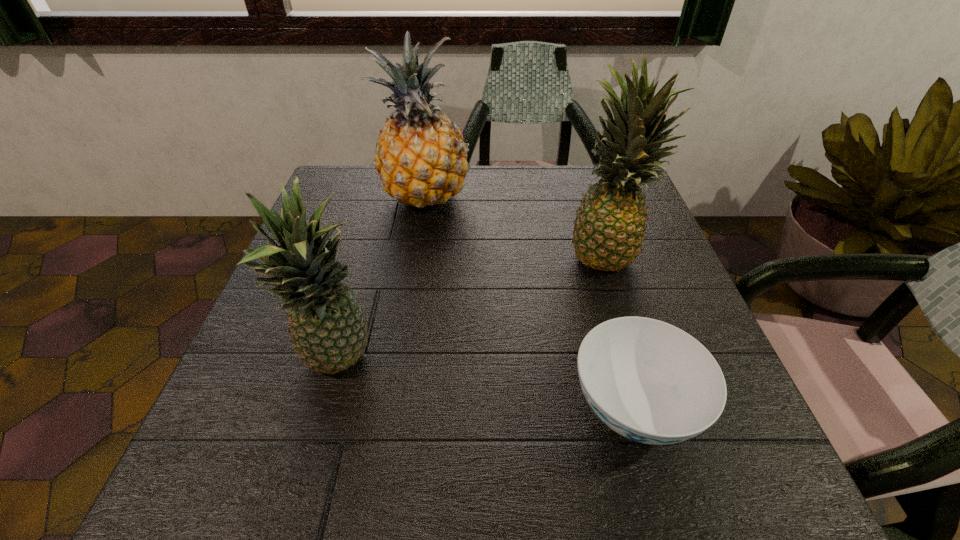
Where is `object located in the near edge section of the desktop`? The height and width of the screenshot is (540, 960). object located in the near edge section of the desktop is located at coordinates (649, 381).

Where is `pineapple that is at the right edge`? This screenshot has width=960, height=540. pineapple that is at the right edge is located at coordinates (609, 227).

The height and width of the screenshot is (540, 960). What are the coordinates of `chinaware present at the right edge` in the screenshot? It's located at (649, 381).

Where is `object that is at the far left corner`? Image resolution: width=960 pixels, height=540 pixels. object that is at the far left corner is located at coordinates (421, 159).

Where is `object present at the near right corner`? The image size is (960, 540). object present at the near right corner is located at coordinates (649, 381).

At what (x,y) coordinates should I click in order to perform the action: click on free space at the far edge. Please return your answer as a coordinate pair (x, y). The height and width of the screenshot is (540, 960). Looking at the image, I should click on (511, 200).

Where is `vacant space at the near edge of the desktop`? This screenshot has width=960, height=540. vacant space at the near edge of the desktop is located at coordinates (338, 460).

I want to click on vacant space at the left edge of the desktop, so click(208, 423).

At what (x,y) coordinates should I click in order to perform the action: click on vacant space at the right edge of the desktop. Please return your answer as a coordinate pair (x, y). This screenshot has width=960, height=540. Looking at the image, I should click on (637, 285).

Where is `blank area at the far left corner`? blank area at the far left corner is located at coordinates (341, 171).